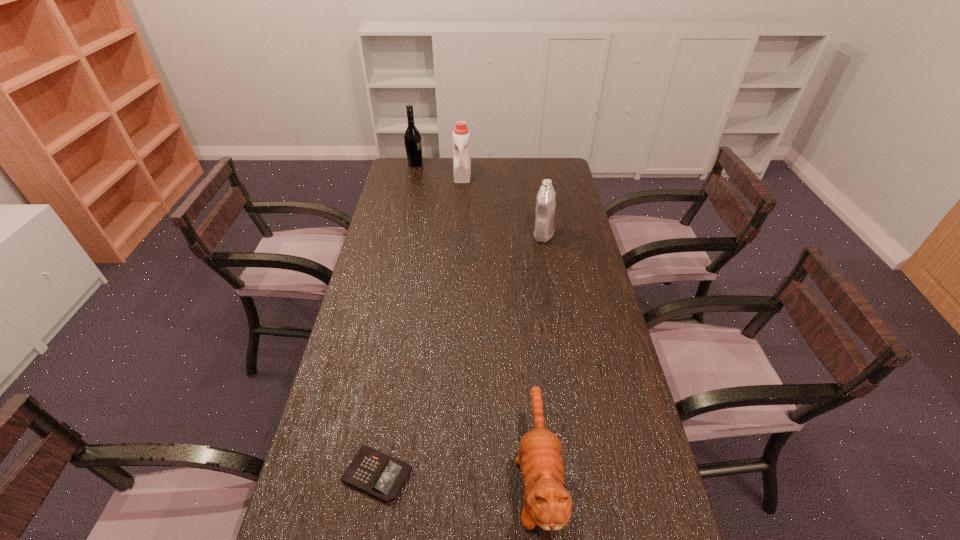
I want to click on wine bottle present at the far edge, so click(x=412, y=138).

Find the location of `detergent situated at the far edge`. detergent situated at the far edge is located at coordinates (461, 135).

The image size is (960, 540). Find the location of `wine bottle at the left edge`. wine bottle at the left edge is located at coordinates (412, 138).

You are a GUI agent. You are given a task and a screenshot of the screen. Output one action in this format:
    pyautogui.click(x=<x>, y=<y>)
    Task: Click on the calculator present at the left edge
    This screenshot has width=960, height=540.
    Given the screenshot: What is the action you would take?
    pyautogui.click(x=378, y=474)

Where is `object at the right edge`? object at the right edge is located at coordinates (545, 207).

Where is `object positioned at the far left corner`? The image size is (960, 540). object positioned at the far left corner is located at coordinates (412, 138).

In the image, there is a desktop. At what (x,y) coordinates should I click in order to perform the action: click on free space at the left edge. Please return your answer as a coordinate pair (x, y). This screenshot has width=960, height=540. Looking at the image, I should click on (373, 271).

Where is `vacant region at the right edge of the desktop`? vacant region at the right edge of the desktop is located at coordinates (555, 259).

Locate an element on the screen. vacant area that lies between the right detergent and the left detergent is located at coordinates (503, 205).

This screenshot has height=540, width=960. What are the coordinates of `vacant space that's between the calculator and the wine bottle` in the screenshot? It's located at (396, 319).